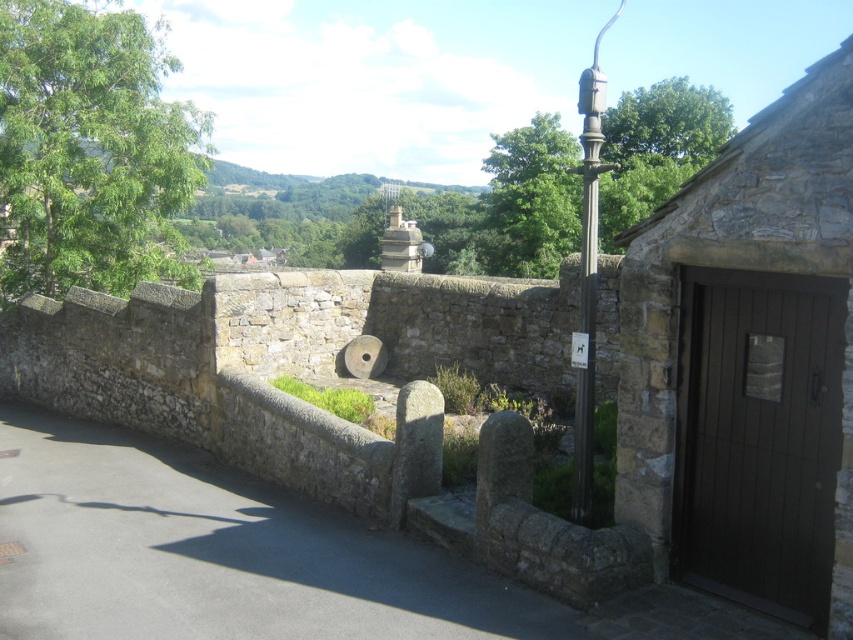
You are standing at the point labeled as point (589, 275) on the polished metal lamp post at center right. You want to walk to the dark wooden door to the right of the wall. Which direction should you face to walk directly towards the dark wooden door?

You should face towards the right direction since the dark wooden door is located to the right of the wall, and you are currently at the polished metal lamp post at center right.